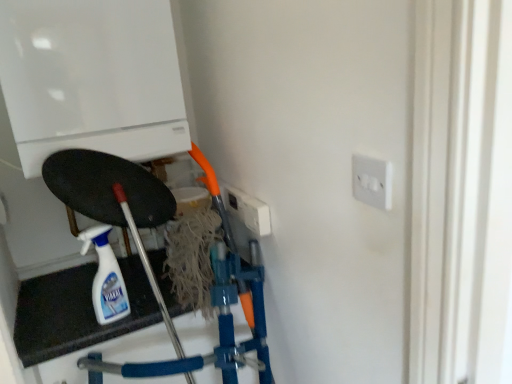
Question: Would you say white glossy spray bottle at lower left is to the left or to the right of white plastic socket at upper right in the picture?

Choices:
 (A) left
 (B) right

Answer: (A)

Question: Is point (109, 304) positioned closer to the camera than point (361, 157)?

Choices:
 (A) closer
 (B) farther

Answer: (B)

Question: Based on their relative distances, which object is farther from the white glossy spray bottle at lower left?

Choices:
 (A) white plastic socket at upper right
 (B) white glossy boiler at upper left

Answer: (A)

Question: Based on their relative distances, which object is farther from the white glossy boiler at upper left?

Choices:
 (A) white plastic socket at upper right
 (B) white glossy spray bottle at lower left

Answer: (A)